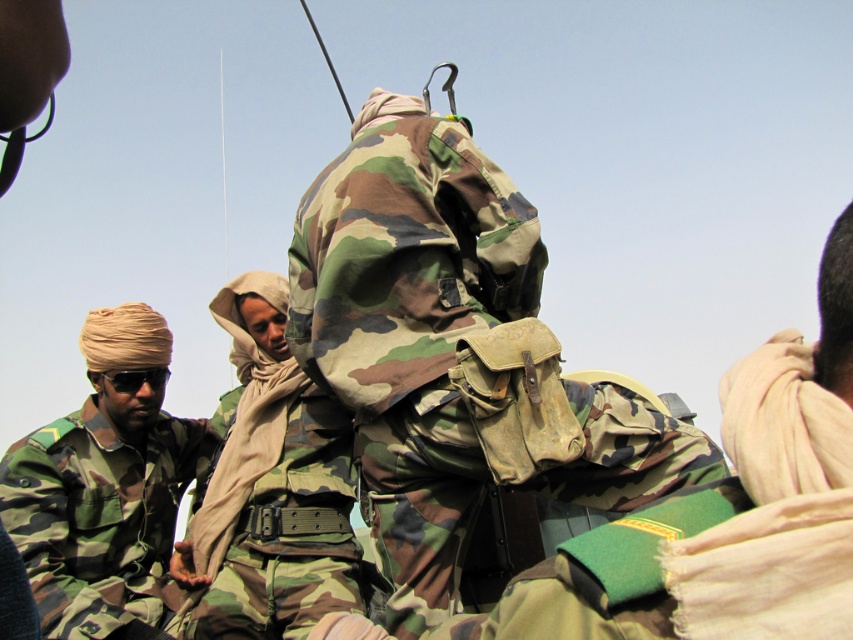
You are a tailor who needs to determine which uniform requires more fabric for a repair. Based on the image, which of the two uniforms, the camouflage fabric uniform at left or the camo fabric uniform at center, would need more fabric?

The camouflage fabric uniform at left requires more fabric for the repair because it is bigger than the camo fabric uniform at center.

You are a drone operator observing the military group. You need to identify which of the two points, point (45,625) or point (236,540), is closer to the camera. Which one is closer?

Point (45,625) is closer to the viewer than point (236,540).

You are a member of the military unit in the image. You need to move from your current position to the radio antenna on the central figure. Which direction should you move relative to the two points labeled point (587, 428) and point (148, 452)?

The radio antenna is located at point (587, 428), which is in front of point (148, 452). Therefore, you should move towards point (587, 428) to reach the radio antenna.